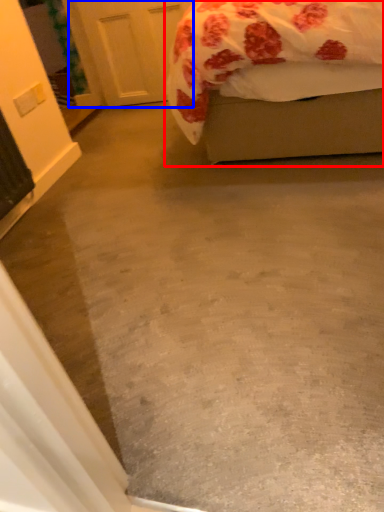
Question: Which object appears farthest to the camera in this image, bed (highlighted by a red box) or door (highlighted by a blue box)?

Choices:
 (A) bed
 (B) door

Answer: (B)